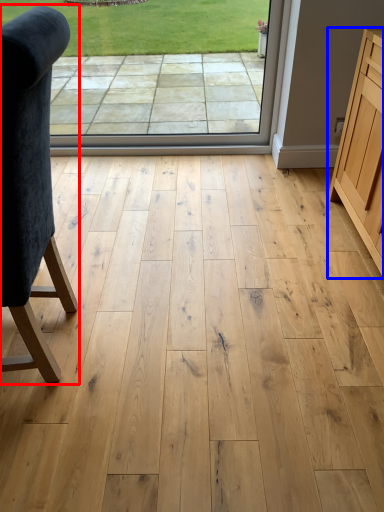
Question: Which of the following is the closest to the observer, chair (highlighted by a red box) or cabinetry (highlighted by a blue box)?

Choices:
 (A) chair
 (B) cabinetry

Answer: (A)